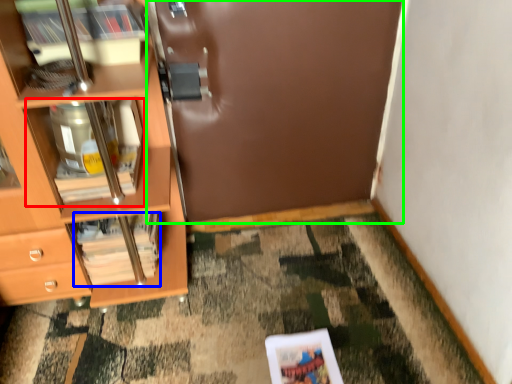
Question: Which is nearer to the cabinet (highlighted by a red box)? magazine (highlighted by a blue box) or door (highlighted by a green box).

Choices:
 (A) magazine
 (B) door

Answer: (A)